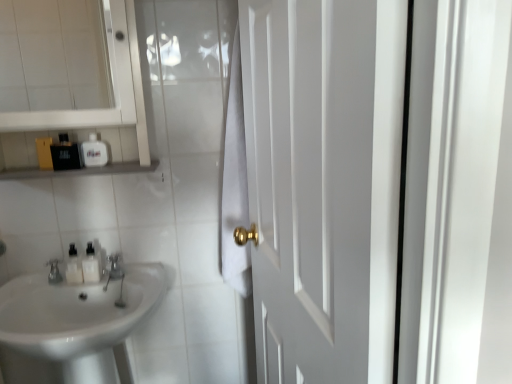
Identify the location of free space to the right of brushed metal faucet at lower left. (147, 267).